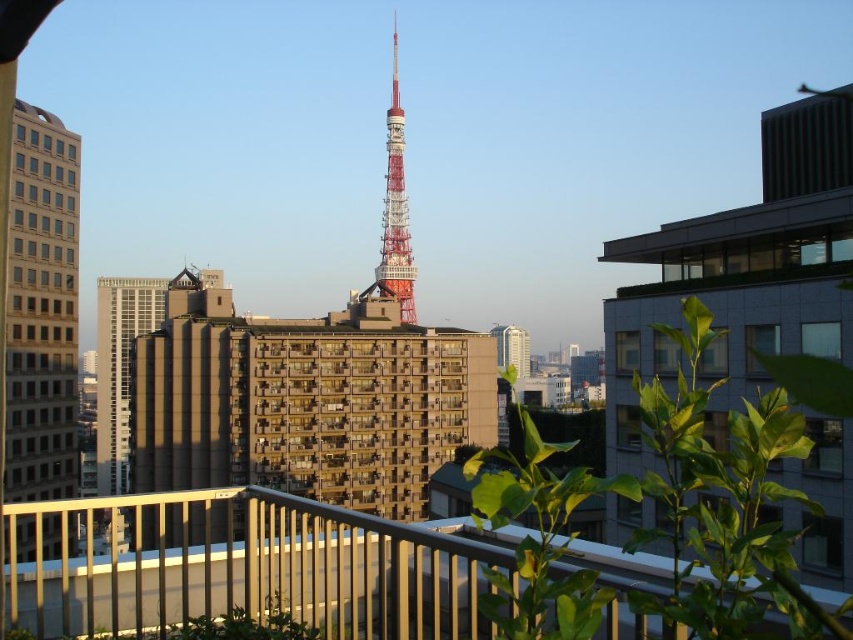
Question: Which object is the closest to the matte brown building at center?

Choices:
 (A) metallic red tower at center
 (B) matte glass skyscraper at left
 (C) metallic railing at lower center

Answer: (C)

Question: Is metallic railing at lower center above matte brown building at center?

Choices:
 (A) yes
 (B) no

Answer: (B)

Question: Based on their relative distances, which object is farther from the matte glass skyscraper at left?

Choices:
 (A) metallic red tower at center
 (B) metallic silver skyscraper at center

Answer: (B)

Question: Among these points, which one is farthest from the camera?

Choices:
 (A) (402, 284)
 (B) (360, 627)
 (C) (10, 332)
 (D) (146, 531)

Answer: (A)

Question: Can you confirm if matte brown building at center is bigger than matte glass skyscraper at left?

Choices:
 (A) no
 (B) yes

Answer: (B)

Question: Does metallic railing at lower center have a lesser width compared to metallic red tower at center?

Choices:
 (A) yes
 (B) no

Answer: (B)